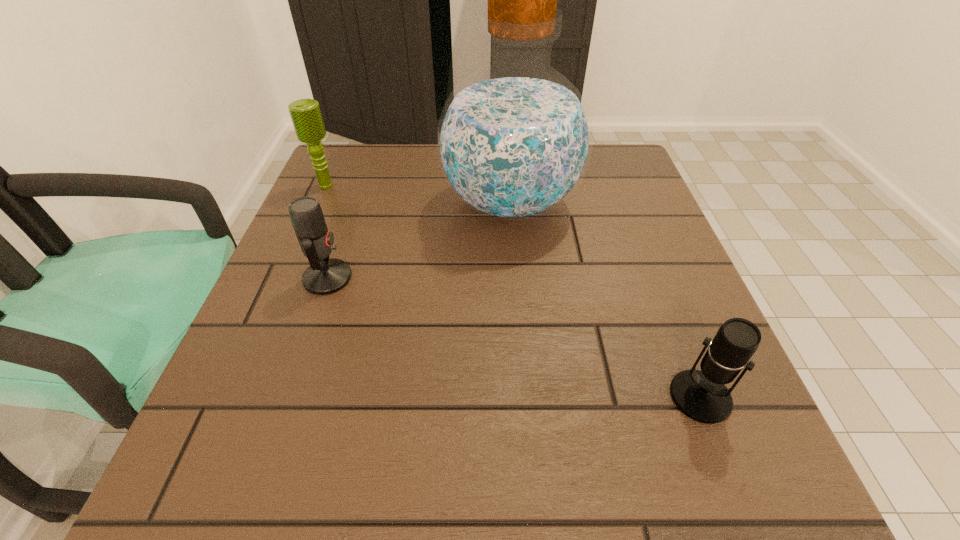
Find the location of `vacant area located on the side of the second microphone from left to right with the red ring`. vacant area located on the side of the second microphone from left to right with the red ring is located at coordinates (545, 278).

I want to click on free space located 0.330m on the back of the nearest microphone, so click(x=637, y=237).

I want to click on water jug situated at the far edge, so pyautogui.click(x=514, y=140).

The width and height of the screenshot is (960, 540). Identify the location of microphone situated at the far edge. (306, 116).

The image size is (960, 540). Identify the location of object that is at the right edge. (701, 395).

Where is `object at the far left corner`? This screenshot has height=540, width=960. object at the far left corner is located at coordinates (306, 116).

Locate an element on the screen. The width and height of the screenshot is (960, 540). free space at the near edge of the desktop is located at coordinates (643, 490).

This screenshot has height=540, width=960. What are the coordinates of `vacant space at the left edge of the desktop` in the screenshot? It's located at (337, 320).

The width and height of the screenshot is (960, 540). Identify the location of blank space at the right edge. (656, 290).

Where is `vacant space at the far left corner of the desktop`? Image resolution: width=960 pixels, height=540 pixels. vacant space at the far left corner of the desktop is located at coordinates (354, 166).